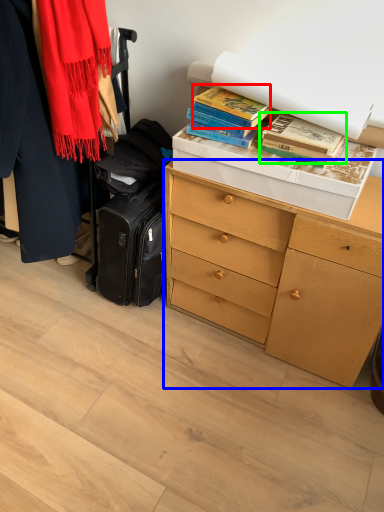
Question: Which is nearer to the book (highlighted by a red box)? chest of drawers (highlighted by a blue box) or book (highlighted by a green box).

Choices:
 (A) chest of drawers
 (B) book

Answer: (B)